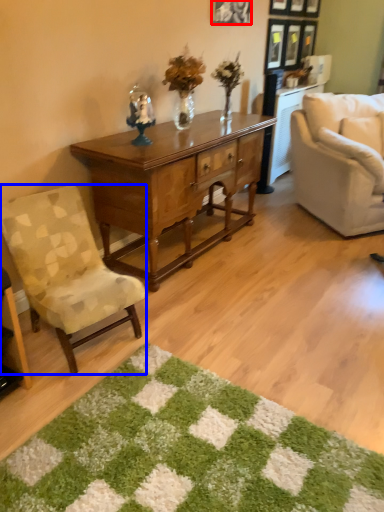
Question: Which object is closer to the camera taking this photo, picture frame (highlighted by a red box) or chair (highlighted by a blue box)?

Choices:
 (A) picture frame
 (B) chair

Answer: (B)